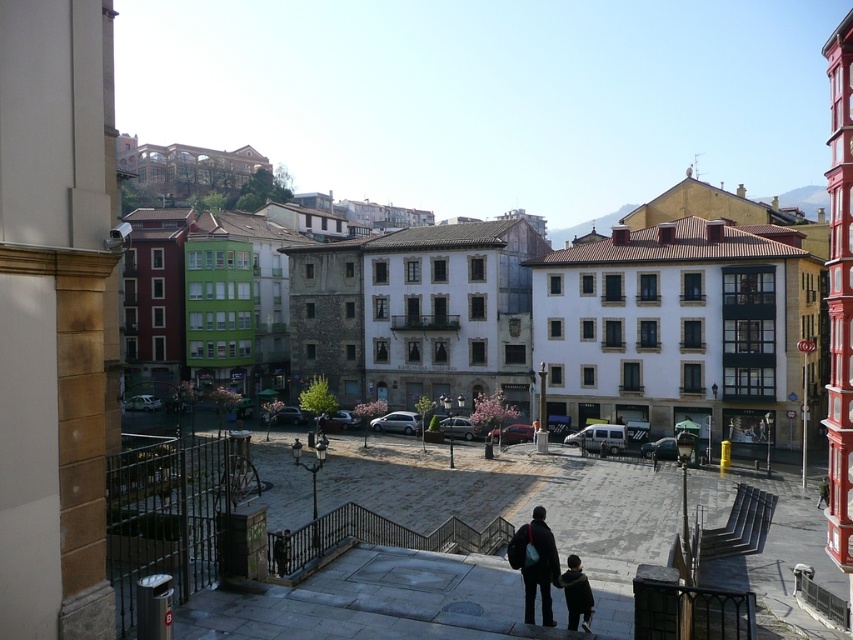
Is white stone building at center further to camera compared to dark blue backpack at lower center?

Yes, white stone building at center is further from the viewer.

Does white stone building at center appear on the left side of dark blue backpack at lower center?

No, white stone building at center is not to the left of dark blue backpack at lower center.

This screenshot has width=853, height=640. In order to click on white stone building at center in this screenshot , I will do `click(583, 321)`.

Identify the location of white stone building at center. (583, 321).

Does point (785, 621) come closer to viewer compared to point (509, 548)?

No, it is behind (509, 548).

Which is more to the right, gray concrete pavement at center or dark blue backpack at lower center?

gray concrete pavement at center is more to the right.

Is point (433, 513) farther from camera compared to point (537, 570)?

Yes, point (433, 513) is farther from viewer.

At what (x,y) coordinates should I click in order to perform the action: click on gray concrete pavement at center. Please return your answer as a coordinate pair (x, y). Looking at the image, I should click on (521, 502).

Which of these two, dark blue backpack at lower center or dark blue jacket at lower center, stands taller?

dark blue backpack at lower center is taller.

Does point (518, 538) lie behind point (576, 568)?

Yes, point (518, 538) is behind point (576, 568).

At what (x,y) coordinates should I click in order to perform the action: click on dark blue backpack at lower center. Please return your answer as a coordinate pair (x, y). The image size is (853, 640). Looking at the image, I should click on (544, 570).